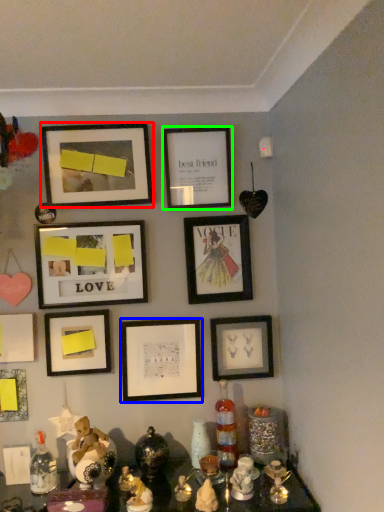
Question: Considering the real-world distances, which object is farthest from picture frame (highlighted by a red box)? picture frame (highlighted by a blue box) or picture frame (highlighted by a green box)?

Choices:
 (A) picture frame
 (B) picture frame

Answer: (A)